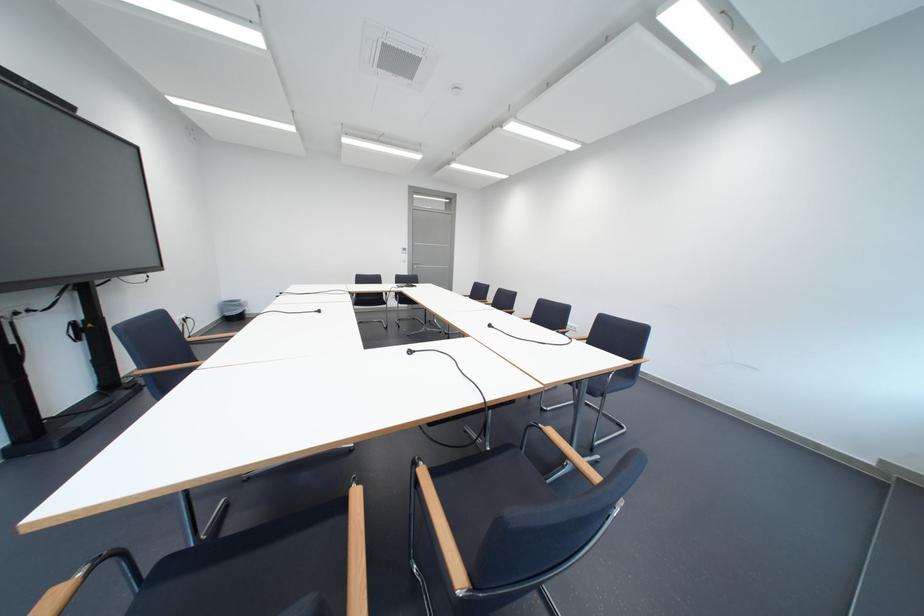
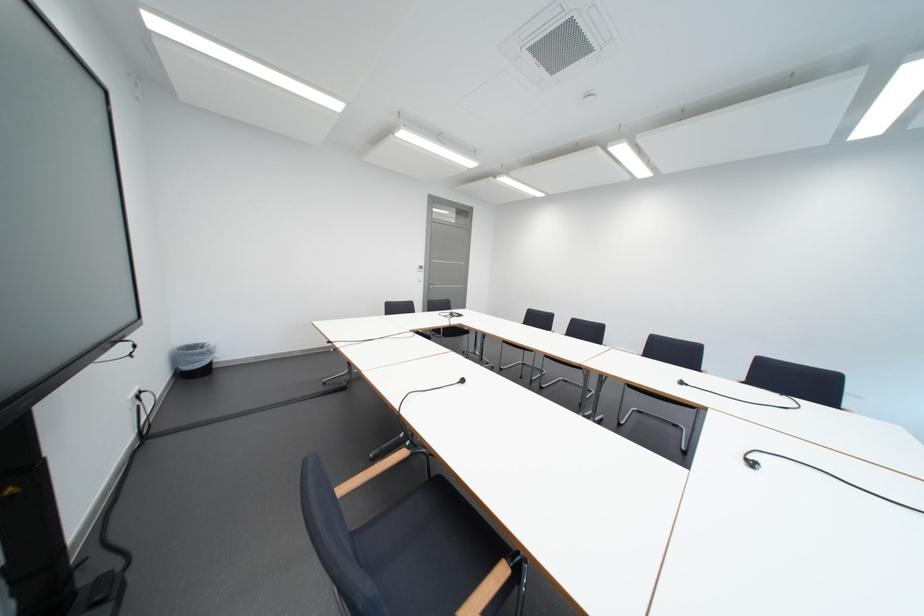
Which direction would the cameraman need to move to produce the second image?

The movement direction of the cameraman is left, forward.